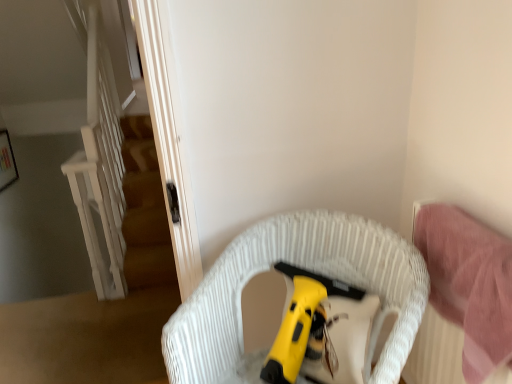
Question: Does pink fabric bed at right have a larger size compared to white woven chair at center?

Choices:
 (A) yes
 (B) no

Answer: (B)

Question: From a real-world perspective, is pink fabric bed at right positioned over white woven chair at center based on gravity?

Choices:
 (A) no
 (B) yes

Answer: (B)

Question: Does pink fabric bed at right have a greater width compared to white woven chair at center?

Choices:
 (A) no
 (B) yes

Answer: (A)

Question: Is pink fabric bed at right not within white woven chair at center?

Choices:
 (A) yes
 (B) no

Answer: (A)

Question: Considering the relative sizes of pink fabric bed at right and white woven chair at center in the image provided, is pink fabric bed at right taller than white woven chair at center?

Choices:
 (A) yes
 (B) no

Answer: (B)

Question: Is pink fabric bed at right aimed at white woven chair at center?

Choices:
 (A) no
 (B) yes

Answer: (B)

Question: From a real-world perspective, does yellow plastic vacuum cleaner at center sit lower than pink fabric bed at right?

Choices:
 (A) yes
 (B) no

Answer: (A)

Question: Considering the relative positions of yellow plastic vacuum cleaner at center and pink fabric bed at right in the image provided, is yellow plastic vacuum cleaner at center to the right of pink fabric bed at right from the viewer's perspective?

Choices:
 (A) no
 (B) yes

Answer: (A)

Question: Can you confirm if yellow plastic vacuum cleaner at center is bigger than pink fabric bed at right?

Choices:
 (A) yes
 (B) no

Answer: (B)

Question: Would you say yellow plastic vacuum cleaner at center is outside pink fabric bed at right?

Choices:
 (A) no
 (B) yes

Answer: (B)

Question: Is there a large distance between yellow plastic vacuum cleaner at center and pink fabric bed at right?

Choices:
 (A) yes
 (B) no

Answer: (B)

Question: Is pink fabric bed at right at the back of yellow plastic vacuum cleaner at center?

Choices:
 (A) no
 (B) yes

Answer: (A)

Question: Considering the relative sizes of white woven chair at center and pink fabric bed at right in the image provided, is white woven chair at center smaller than pink fabric bed at right?

Choices:
 (A) yes
 (B) no

Answer: (B)